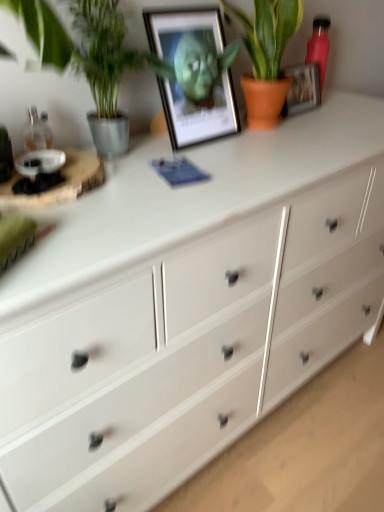
Locate an element on the screen. free space to the right of green leafy plant at left, which is counted as the first houseplant, starting from the left is located at coordinates (201, 159).